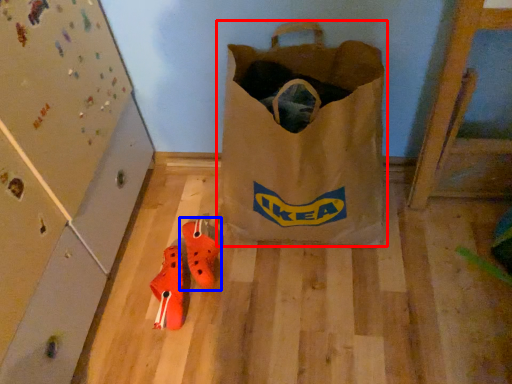
Question: Which object is further to the camera taking this photo, luggage and bags (highlighted by a red box) or footwear (highlighted by a blue box)?

Choices:
 (A) luggage and bags
 (B) footwear

Answer: (B)